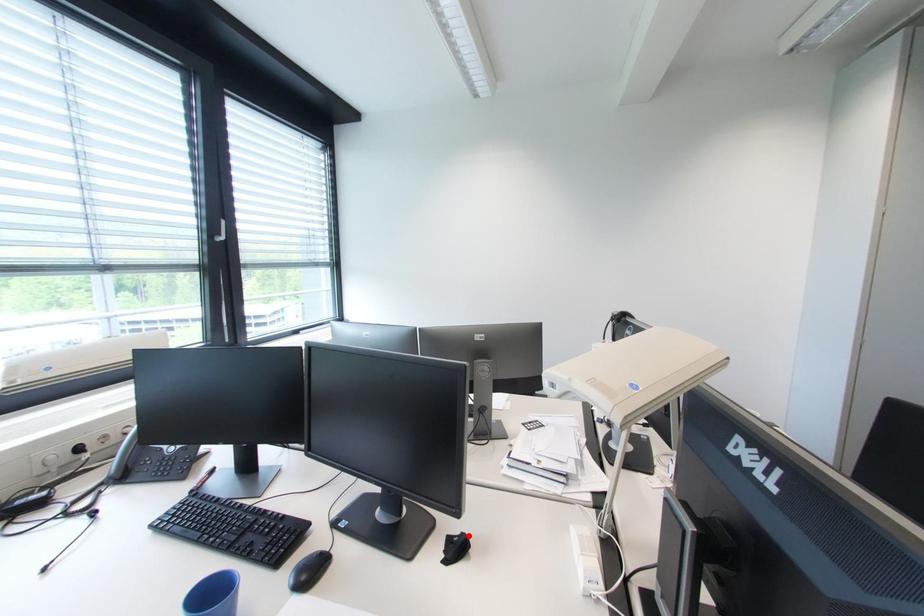
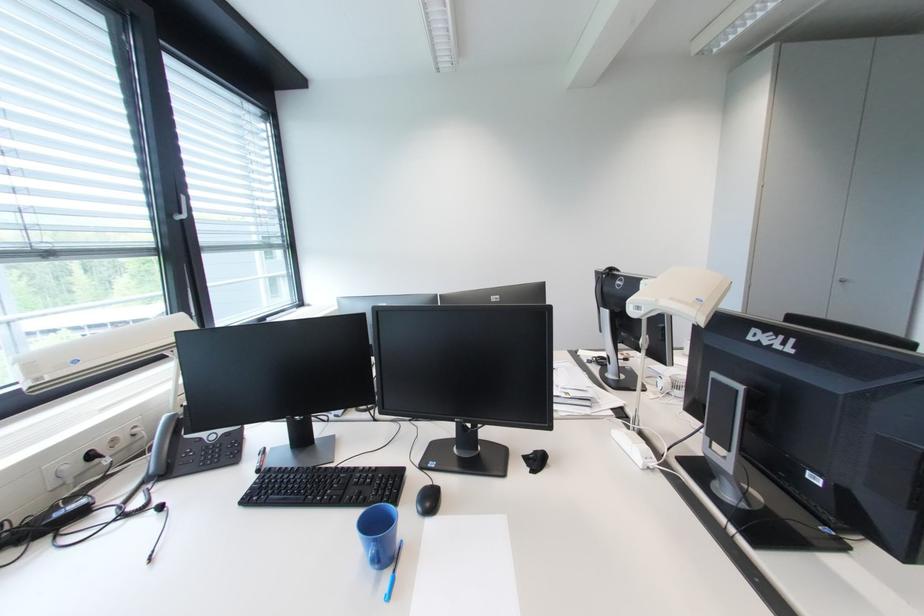
Question: I am providing you with two images of the same scene from different viewpoints. Image1 has a red point marked. In image2, the corresponding 3D location appears at what relative position? Reply with the corresponding letter.

Choices:
 (A) Closer
 (B) Farther

Answer: (A)